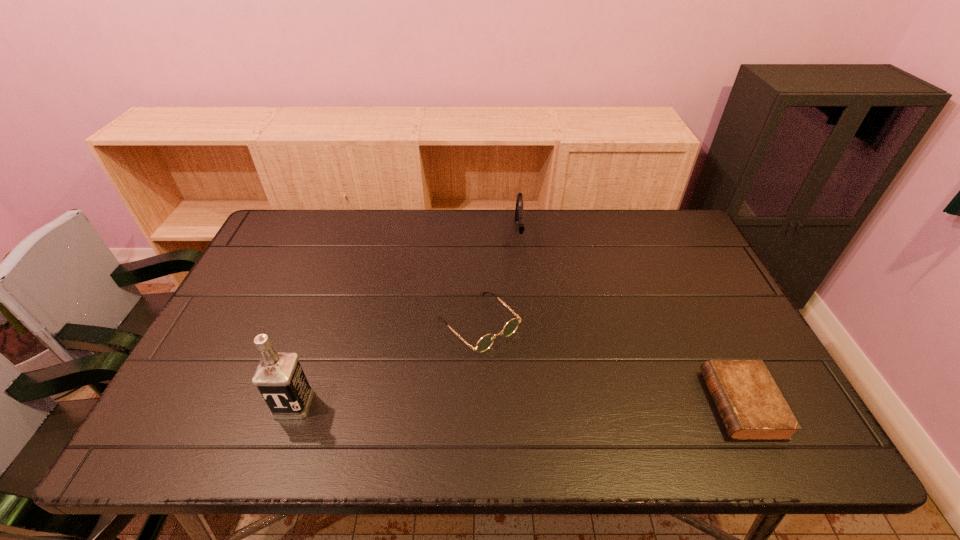
Locate an element on the screen. free space on the desktop that is between the leftmost object and the rightmost object and is positioned on the lenses of the spectacles is located at coordinates (561, 404).

This screenshot has width=960, height=540. In order to click on vacant space on the desktop that is between the leftmost object and the diary and is positioned at the aiming end of the gun in this screenshot , I will do `click(527, 404)`.